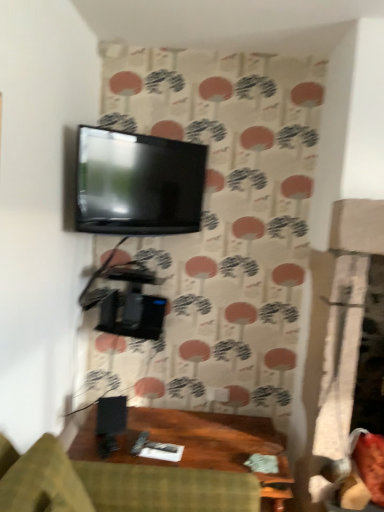
What do you see at coordinates (356, 473) in the screenshot? I see `leather swivel chair at lower right` at bounding box center [356, 473].

Describe the element at coordinates (138, 184) in the screenshot. The height and width of the screenshot is (512, 384). I see `matte black tv at upper center` at that location.

You are a GUI agent. You are given a task and a screenshot of the screen. Output one action in this format:
    pyautogui.click(x=<x>, y=<y>)
    Task: Click on the green fabric studio couch at lower center
    
    Given the screenshot: What is the action you would take?
    pyautogui.click(x=117, y=485)

Is black matte speaker at lower center facing away from green fabric studio couch at lower center?

No, black matte speaker at lower center is not facing away from green fabric studio couch at lower center.

Visually, is black matte speaker at lower center positioned to the left or to the right of green fabric studio couch at lower center?

In the image, black matte speaker at lower center appears on the left side of green fabric studio couch at lower center.

Based on the photo, would you say green fabric studio couch at lower center is part of black matte speaker at lower center's contents?

Actually, green fabric studio couch at lower center is outside black matte speaker at lower center.

Considering the relative sizes of leather swivel chair at lower right and black matte speaker at lower center in the image provided, is leather swivel chair at lower right bigger than black matte speaker at lower center?

Correct, leather swivel chair at lower right is larger in size than black matte speaker at lower center.

From their relative heights in the image, would you say leather swivel chair at lower right is taller or shorter than black matte speaker at lower center?

Considering their sizes, leather swivel chair at lower right has more height than black matte speaker at lower center.

Can you confirm if leather swivel chair at lower right is wider than black matte speaker at lower center?

Yes, leather swivel chair at lower right is wider than black matte speaker at lower center.

Considering the relative sizes of matte black tv at upper center and black matte speaker at lower center in the image provided, is matte black tv at upper center taller than black matte speaker at lower center?

Indeed, matte black tv at upper center has a greater height compared to black matte speaker at lower center.

From a real-world perspective, is matte black tv at upper center positioned above or below black matte speaker at lower center?

matte black tv at upper center is above black matte speaker at lower center.

Does point (171, 229) lie in front of point (99, 409)?

No, (171, 229) is behind (99, 409).

Is matte black tv at upper center facing away from black matte speaker at lower center?

matte black tv at upper center is not turned away from black matte speaker at lower center.

From a real-world perspective, which object rests below the other?

leather swivel chair at lower right.

Would you consider leather swivel chair at lower right to be distant from matte black tv at upper center?

Yes, leather swivel chair at lower right and matte black tv at upper center are quite far apart.

Is leather swivel chair at lower right in front of or behind matte black tv at upper center in the image?

leather swivel chair at lower right is behind matte black tv at upper center.

You are a GUI agent. You are given a task and a screenshot of the screen. Output one action in this format:
    pyautogui.click(x=<x>, y=<y>)
    Task: Click on the swivel chair that is behind the matte black tv at upper center
    This screenshot has height=512, width=384.
    Given the screenshot: What is the action you would take?
    pyautogui.click(x=356, y=473)

Is matte black tv at upper center facing away from leather swivel chair at lower right?

No, leather swivel chair at lower right is not at the back of matte black tv at upper center.

Would you say matte black tv at upper center is a long distance from leather swivel chair at lower right?

Yes, matte black tv at upper center is far from leather swivel chair at lower right.

Would you say matte black tv at upper center is outside leather swivel chair at lower right?

Yes, matte black tv at upper center is not within leather swivel chair at lower right.

Is matte black tv at upper center directly adjacent to green fabric studio couch at lower center?

They are not placed beside each other.

Would you say matte black tv at upper center contains green fabric studio couch at lower center?

No, green fabric studio couch at lower center is not inside matte black tv at upper center.

Between matte black tv at upper center and green fabric studio couch at lower center, which one has less height?

With less height is green fabric studio couch at lower center.

From the image's perspective, relative to green fabric studio couch at lower center, is matte black tv at upper center above or below?

Based on their image positions, matte black tv at upper center is located above green fabric studio couch at lower center.

Can you confirm if leather swivel chair at lower right is thinner than green fabric studio couch at lower center?

Yes.

Which object is more forward, leather swivel chair at lower right or green fabric studio couch at lower center?

green fabric studio couch at lower center is closer to the camera.

From a real-world perspective, which is physically above, leather swivel chair at lower right or green fabric studio couch at lower center?

leather swivel chair at lower right.

Locate an element on the screen. studio couch lying below the leather swivel chair at lower right (from the image's perspective) is located at coordinates pos(117,485).

Locate an element on the screen. The image size is (384, 512). studio couch on the right of black matte speaker at lower center is located at coordinates (117, 485).

The height and width of the screenshot is (512, 384). I want to click on swivel chair in front of the black matte speaker at lower center, so click(356, 473).

Consider the image. Which object lies nearer to the anchor point black matte speaker at lower center, leather swivel chair at lower right or matte black tv at upper center?

matte black tv at upper center is positioned closer to the anchor black matte speaker at lower center.

When comparing their distances from black matte speaker at lower center, does green fabric studio couch at lower center or matte black tv at upper center seem further?

matte black tv at upper center.

Based on their spatial positions, is matte black tv at upper center or leather swivel chair at lower right further from green fabric studio couch at lower center?

matte black tv at upper center is positioned further to the anchor green fabric studio couch at lower center.

Considering their positions, is leather swivel chair at lower right positioned further to matte black tv at upper center than black matte speaker at lower center?

The object further to matte black tv at upper center is leather swivel chair at lower right.

In the scene shown: Considering their positions, is leather swivel chair at lower right positioned further to matte black tv at upper center than green fabric studio couch at lower center?

Based on the image, leather swivel chair at lower right appears to be further to matte black tv at upper center.

Based on their spatial positions, is black matte speaker at lower center or matte black tv at upper center further from green fabric studio couch at lower center?

Among the two, matte black tv at upper center is located further to green fabric studio couch at lower center.

When comparing their distances from leather swivel chair at lower right, does matte black tv at upper center or green fabric studio couch at lower center seem closer?

green fabric studio couch at lower center.

When comparing their distances from green fabric studio couch at lower center, does leather swivel chair at lower right or black matte speaker at lower center seem further?

Among the two, leather swivel chair at lower right is located further to green fabric studio couch at lower center.

Image resolution: width=384 pixels, height=512 pixels. I want to click on speaker between matte black tv at upper center and leather swivel chair at lower right from top to bottom, so (111, 415).

Identify the location of speaker between matte black tv at upper center and green fabric studio couch at lower center in the up-down direction. (111, 415).

You are a GUI agent. You are given a task and a screenshot of the screen. Output one action in this format:
    pyautogui.click(x=<x>, y=<y>)
    Task: Click on the studio couch situated between black matte speaker at lower center and leather swivel chair at lower right from left to right
    
    Given the screenshot: What is the action you would take?
    pyautogui.click(x=117, y=485)

You are a GUI agent. You are given a task and a screenshot of the screen. Output one action in this format:
    pyautogui.click(x=<x>, y=<y>)
    Task: Click on the swivel chair between matte black tv at upper center and green fabric studio couch at lower center in the vertical direction
    The width and height of the screenshot is (384, 512).
    Given the screenshot: What is the action you would take?
    (x=356, y=473)